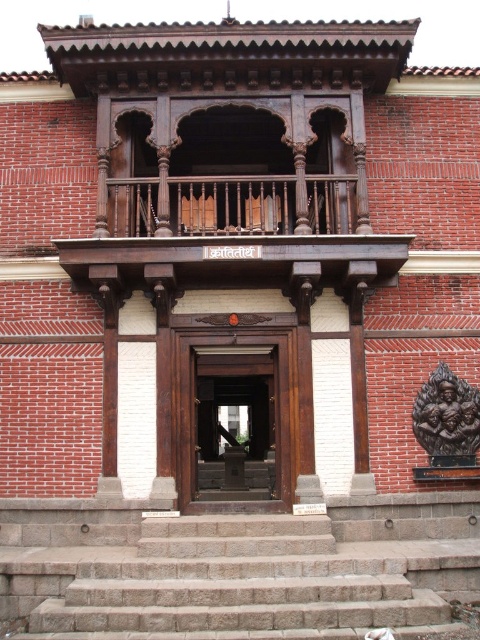
Question: Is dark wood door at center positioned behind polished wood railing at upper center?

Choices:
 (A) yes
 (B) no

Answer: (B)

Question: Which object is positioned closest to the brown stone stairs at lower center?

Choices:
 (A) dark wood door at center
 (B) polished wood railing at upper center

Answer: (A)

Question: Among these points, which one is farthest from the camera?

Choices:
 (A) (134, 218)
 (B) (70, 518)
 (C) (205, 442)

Answer: (C)

Question: Does brown stone stairs at lower center have a larger size compared to dark wood door at center?

Choices:
 (A) no
 (B) yes

Answer: (A)

Question: Can you confirm if brown stone stairs at lower center is bigger than dark wood door at center?

Choices:
 (A) no
 (B) yes

Answer: (A)

Question: Which point is farther to the camera?

Choices:
 (A) brown stone stairs at lower center
 (B) polished wood railing at upper center
 (C) dark wood door at center

Answer: (B)